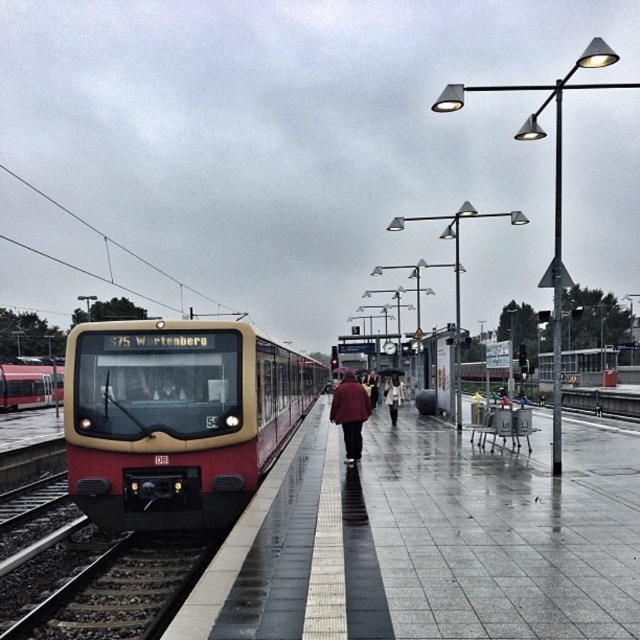
Where is `red matte train at left`? red matte train at left is located at coordinates (29, 385).

Does red matte train at left appear over light beige coat at center?

No, red matte train at left is not above light beige coat at center.

The image size is (640, 640). I want to click on red matte train at left, so click(x=29, y=385).

Who is more forward, [28,365] or [176,388]?

Point [176,388] is in front.

Who is taller, red matte train at left or matte black jacket at center?

red matte train at left is taller.

I want to click on red matte train at left, so click(x=29, y=385).

Is red wool coat at center bigger than matte black jacket at center?

Yes, red wool coat at center is bigger than matte black jacket at center.

Which is in front, point (342, 417) or point (180, 392)?

Point (180, 392) is in front.

Who is more forward, (362, 420) or (164, 384)?

Point (164, 384) is more forward.

Find the location of a particular element. red wool coat at center is located at coordinates (349, 413).